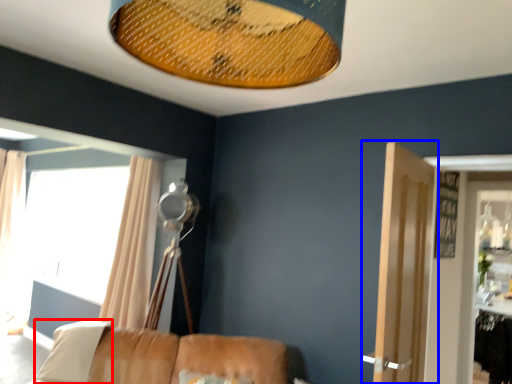
Question: Which object is closer to the camera taking this photo, pillow (highlighted by a red box) or door (highlighted by a blue box)?

Choices:
 (A) pillow
 (B) door

Answer: (B)